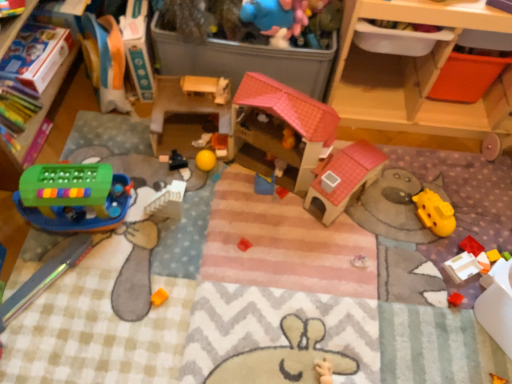
Identify the location of vacant area on the back side of white plastic block at lower right, acting as the eighth toy starting from the left. (455, 228).